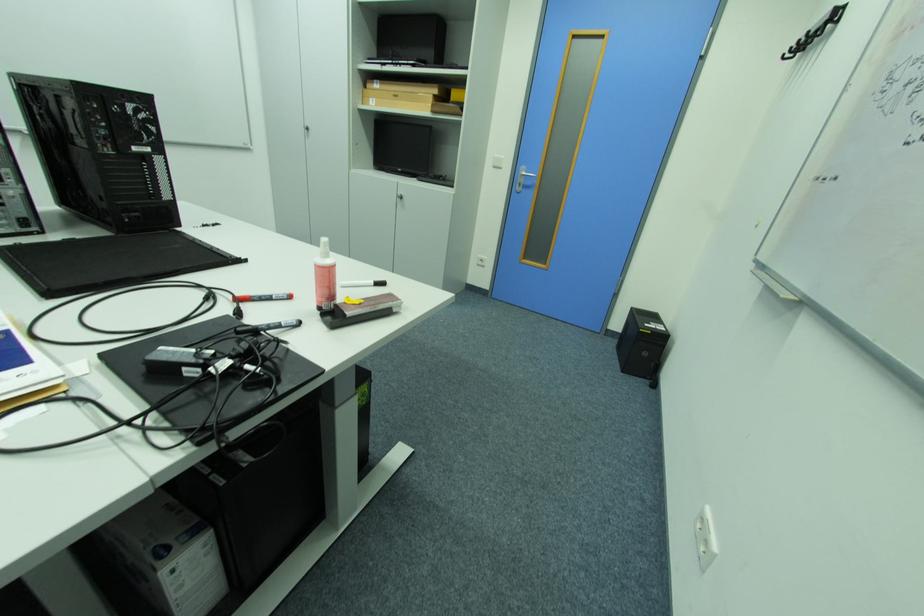
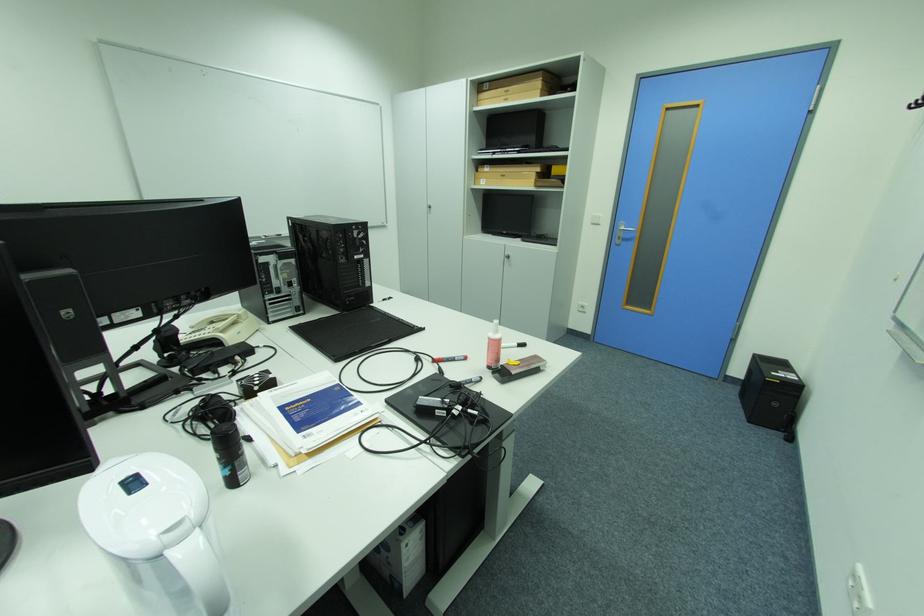
Where in the second image is the point corresponding to [379,100] from the first image?

(490, 180)